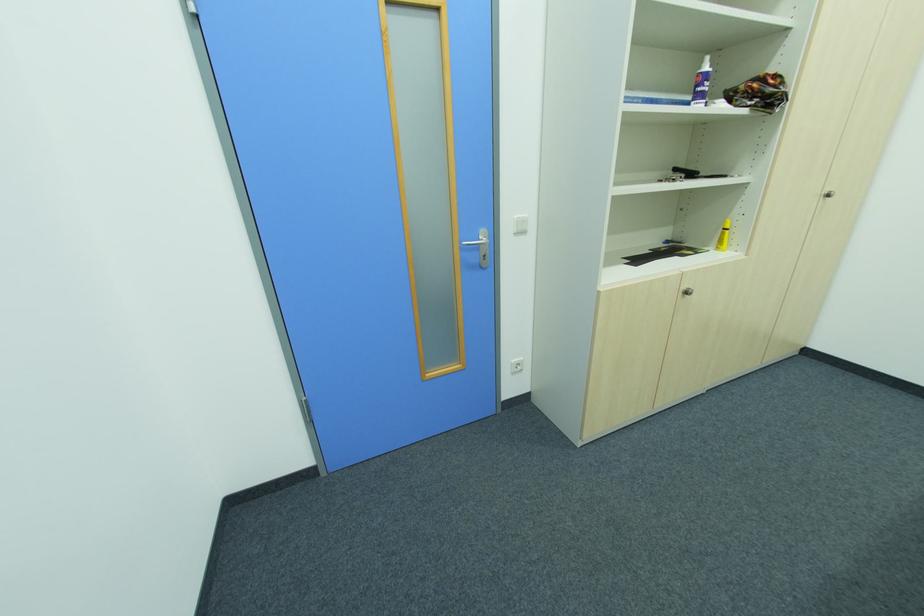
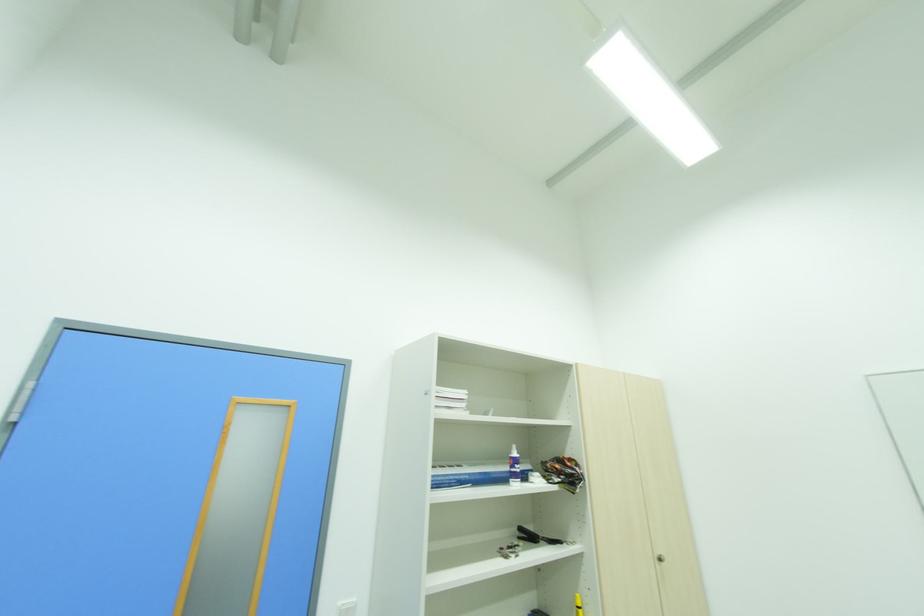
Locate, in the second image, the point that corresponds to the point at 708,87 in the first image.

(520, 469)